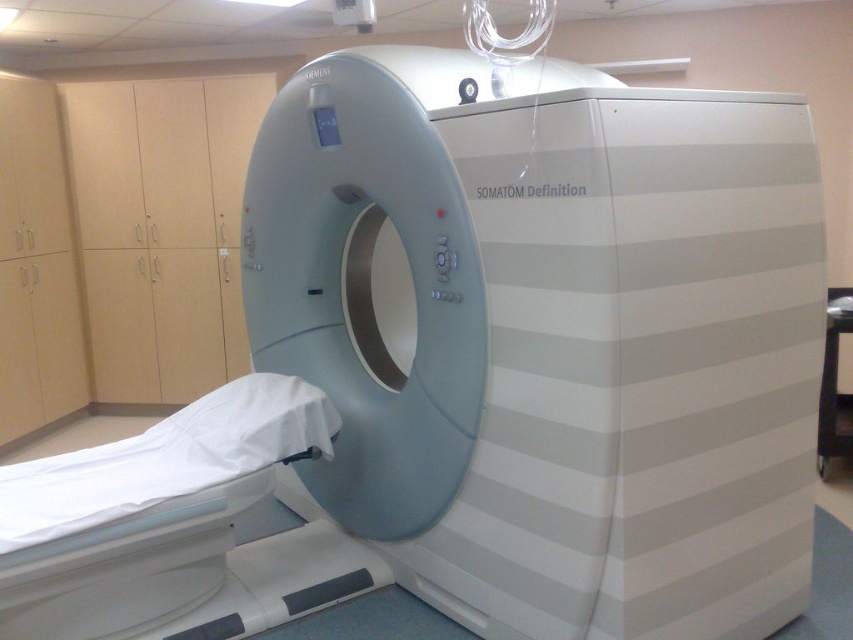
Question: Is white glossy mri scanner at center smaller than white fabric bed at lower left?

Choices:
 (A) no
 (B) yes

Answer: (A)

Question: Does white glossy mri scanner at center lie in front of white fabric bed at lower left?

Choices:
 (A) yes
 (B) no

Answer: (A)

Question: Is white glossy mri scanner at center bigger than white fabric bed at lower left?

Choices:
 (A) no
 (B) yes

Answer: (B)